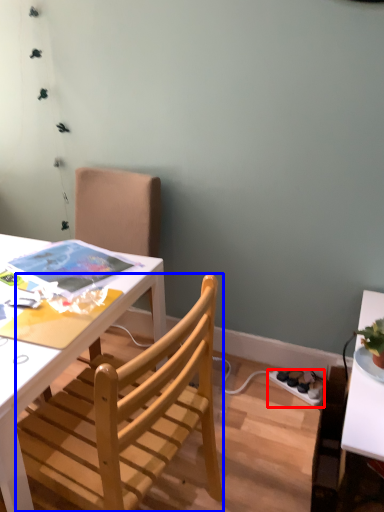
Question: Among these objects, which one is farthest to the camera, power outlet (highlighted by a red box) or chair (highlighted by a blue box)?

Choices:
 (A) power outlet
 (B) chair

Answer: (A)